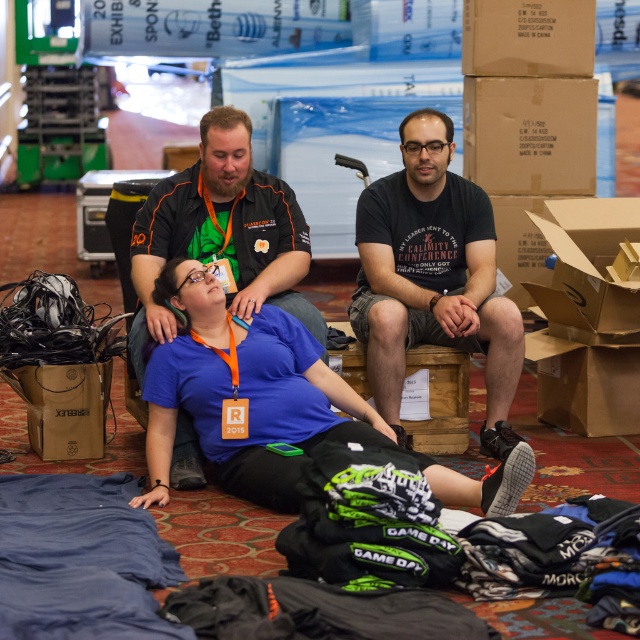
Question: Which object appears closest to the camera in this image?

Choices:
 (A) black cotton t-shirt at center
 (B) brown cardboard box at upper center

Answer: (A)

Question: Is blue fabric at center below brown cardboard box at upper center?

Choices:
 (A) yes
 (B) no

Answer: (A)

Question: Which object appears farthest from the camera in this image?

Choices:
 (A) blue fabric at center
 (B) brown paper bag at lower left
 (C) brown paper cardboard box at lower right
 (D) brown cardboard box at upper right

Answer: (D)

Question: Can you confirm if brown cardboard box at upper center is wider than cardboard box at right?

Choices:
 (A) no
 (B) yes

Answer: (B)

Question: Which of the following is the closest to the observer?

Choices:
 (A) (548, 77)
 (B) (445, 376)
 (C) (630, 417)
 (D) (26, 390)

Answer: (D)

Question: Can you confirm if matte black shirt at center is positioned to the left of blue fabric at center?

Choices:
 (A) no
 (B) yes

Answer: (B)